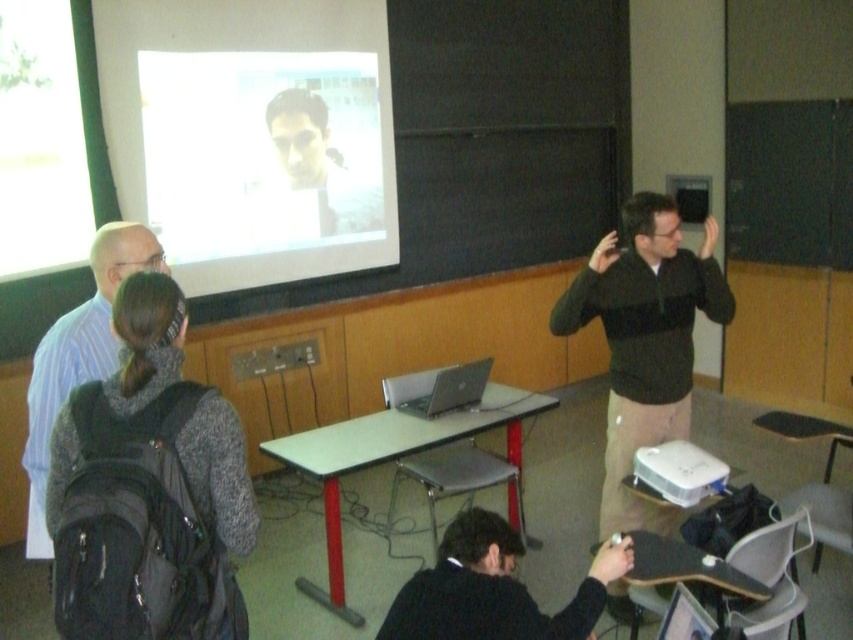
Question: Is dark gray backpack at left thinner than white plastic projector at lower center?

Choices:
 (A) no
 (B) yes

Answer: (A)

Question: Which point is farther from the camera taking this photo?

Choices:
 (A) (329, 65)
 (B) (468, 385)
 (C) (680, 454)
 (D) (44, 403)

Answer: (A)

Question: Where is white glossy table at center located in relation to silver metallic laptop at center in the image?

Choices:
 (A) above
 (B) below

Answer: (B)

Question: Can you confirm if white plastic projector at lower center is wider than silver metallic laptop at center?

Choices:
 (A) no
 (B) yes

Answer: (A)

Question: Which object is farther from the camera taking this photo?

Choices:
 (A) white plastic projector at lower center
 (B) white glossy table at center
 (C) gray sweater at left
 (D) dark gray backpack at left

Answer: (B)

Question: Among these objects, which one is nearest to the camera?

Choices:
 (A) black matte jacket at lower center
 (B) white plastic projector at lower center
 (C) white glossy projector screen at upper center
 (D) silver metallic laptop at center

Answer: (A)